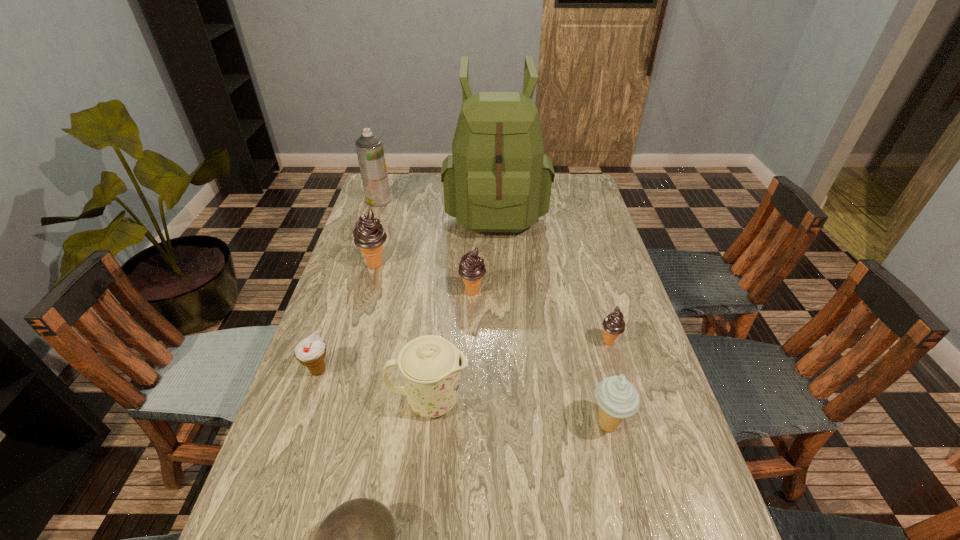
This screenshot has height=540, width=960. What are the coordinates of `the tallest object` in the screenshot? It's located at (497, 180).

Where is `backpack`? The height and width of the screenshot is (540, 960). backpack is located at coordinates (497, 180).

Where is `the eighth shortest object`? The image size is (960, 540). the eighth shortest object is located at coordinates (369, 147).

I want to click on the tallest icecream, so click(369, 234).

Find the location of a particular element. This screenshot has width=960, height=540. the seventh nearest object is located at coordinates (369, 234).

I want to click on chinaware, so click(431, 365).

Find the location of a particular element. beige icecream is located at coordinates (617, 398).

At what (x,y) coordinates should I click in order to perform the action: click on the fourth nearest icecream. Please return your answer as a coordinate pair (x, y). This screenshot has width=960, height=540. Looking at the image, I should click on (471, 268).

Find the location of a particular element. This screenshot has height=540, width=960. the second chocolate icecream from left to right is located at coordinates (471, 268).

At what (x,y) coordinates should I click in order to perform the action: click on the second nearest icecream. Please return your answer as a coordinate pair (x, y). This screenshot has width=960, height=540. Looking at the image, I should click on (311, 352).